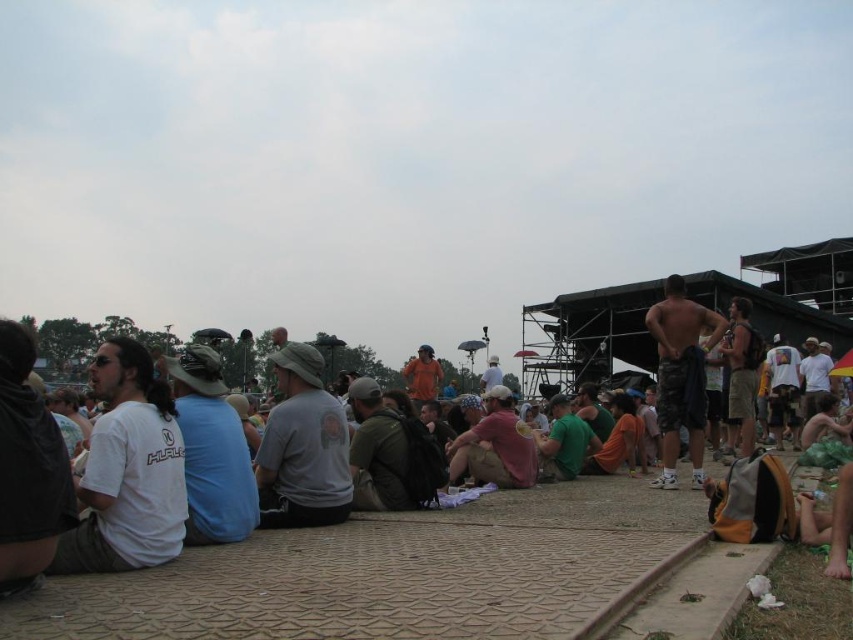
Question: Which of these objects is positioned closest to the pink fabric shirt at center?

Choices:
 (A) camouflage shorts at center
 (B) gray matte t-shirt at center

Answer: (A)

Question: Does white cotton t-shirt at lower left appear under pink fabric shirt at center?

Choices:
 (A) no
 (B) yes

Answer: (A)

Question: Which object is positioned farthest from the gray matte t-shirt at center?

Choices:
 (A) camouflage shorts at center
 (B) white cotton t-shirt at lower left

Answer: (A)

Question: Is white cotton t-shirt at lower left to the right of gray matte t-shirt at center from the viewer's perspective?

Choices:
 (A) no
 (B) yes

Answer: (A)

Question: Which point is farther to the camera?

Choices:
 (A) (488, 400)
 (B) (161, 516)
 (C) (679, 356)

Answer: (A)

Question: Considering the relative positions of gray matte t-shirt at center and camouflage shorts at center in the image provided, where is gray matte t-shirt at center located with respect to camouflage shorts at center?

Choices:
 (A) above
 (B) below

Answer: (B)